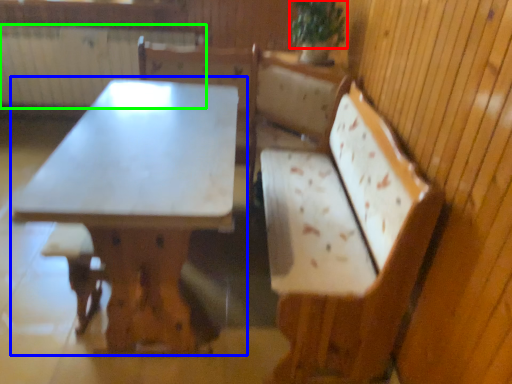
Question: Which is farther away from plant (highlighted by a red box)? table (highlighted by a blue box) or radiator (highlighted by a green box)?

Choices:
 (A) table
 (B) radiator

Answer: (B)